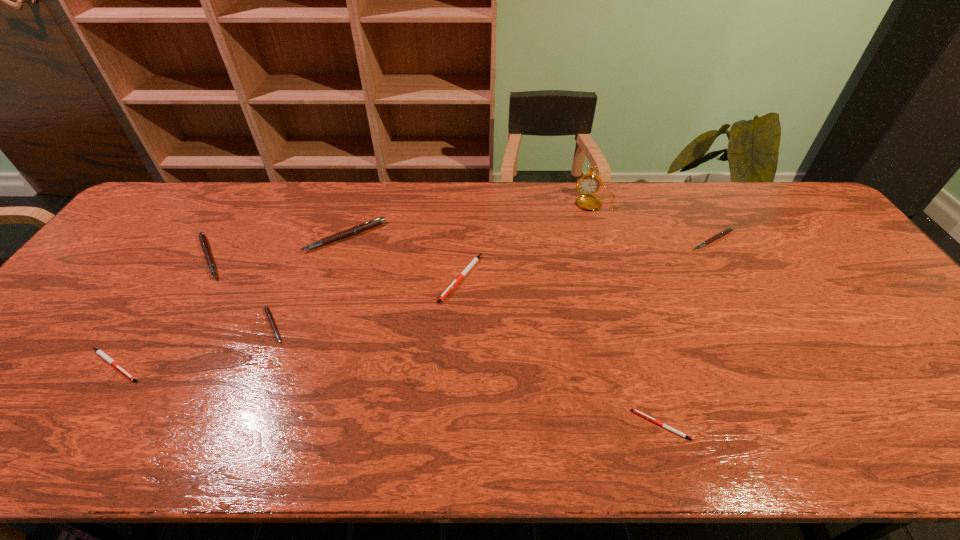
The width and height of the screenshot is (960, 540). I want to click on unoccupied area between the farthest white pen and the sixth farthest pen, so click(x=288, y=321).

In order to click on empty space that is in between the fifth farthest pen and the rightmost pen in this screenshot , I will do pyautogui.click(x=493, y=282).

Where is `free space between the leftmost white pen and the tallest object`? free space between the leftmost white pen and the tallest object is located at coordinates (355, 284).

Identify the location of free space between the second white pen from right to left and the farthest object. Image resolution: width=960 pixels, height=540 pixels. (529, 240).

This screenshot has width=960, height=540. I want to click on object that is the closest to the shortest pen, so click(473, 262).

Select which object is the second closest to the nearest pink pen. Please provide its 2D coordinates. Your answer should be formatted as a tuple, i.e. [(x, y)], where the tuple contains the x and y coordinates of a point satisfying the conditions above.

[(367, 225)]

At what (x,y) coordinates should I click in order to perform the action: click on the second closest pen relative to the smallest pink pen. Please return your answer as a coordinate pair (x, y). This screenshot has width=960, height=540. Looking at the image, I should click on (367, 225).

Point out which pen is positioned as the nearest to the smallest pink pen. Please provide its 2D coordinates. Your answer should be formatted as a tuple, i.e. [(x, y)], where the tuple contains the x and y coordinates of a point satisfying the conditions above.

[(203, 241)]

Where is `pink pen that is the third nearest to the tallest pen`? pink pen that is the third nearest to the tallest pen is located at coordinates (728, 230).

Locate which pink pen ranks in proximity to the fifth object from left to right. Please provide its 2D coordinates. Your answer should be formatted as a tuple, i.e. [(x, y)], where the tuple contains the x and y coordinates of a point satisfying the conditions above.

[(367, 225)]